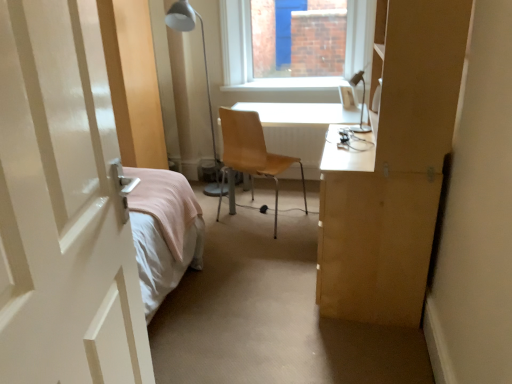
Question: Does light brown wood chair at center have a greater height compared to white glossy door at left?

Choices:
 (A) yes
 (B) no

Answer: (B)

Question: Is light brown wood chair at center wider than white glossy door at left?

Choices:
 (A) yes
 (B) no

Answer: (B)

Question: Could you tell me if light brown wood chair at center is turned towards white glossy door at left?

Choices:
 (A) yes
 (B) no

Answer: (B)

Question: Does light brown wood chair at center appear on the right side of white glossy door at left?

Choices:
 (A) no
 (B) yes

Answer: (B)

Question: Is light brown wood chair at center outside white glossy door at left?

Choices:
 (A) no
 (B) yes

Answer: (B)

Question: Is point (173, 64) positioned closer to the camera than point (245, 114)?

Choices:
 (A) farther
 (B) closer

Answer: (A)

Question: Considering their positions, is white metal table lamp at upper center, the first table lamp in the left-to-right sequence, located in front of or behind light brown wood chair at center?

Choices:
 (A) behind
 (B) front

Answer: (A)

Question: From a real-world perspective, is white metal table lamp at upper center, the first table lamp in the left-to-right sequence, positioned above or below light brown wood chair at center?

Choices:
 (A) above
 (B) below

Answer: (A)

Question: Choose the correct answer: Is white metal table lamp at upper center, which appears as the 2th table lamp when viewed from the front, inside light brown wood chair at center or outside it?

Choices:
 (A) inside
 (B) outside

Answer: (B)

Question: Is light brown wood chair at center spatially inside metallic silver table lamp at upper right, which is the second table lamp in left-to-right order, or outside of it?

Choices:
 (A) outside
 (B) inside

Answer: (A)

Question: Considering the positions of light brown wood chair at center and metallic silver table lamp at upper right, arranged as the 1th table lamp when viewed from the right, in the image, is light brown wood chair at center taller or shorter than metallic silver table lamp at upper right, arranged as the 1th table lamp when viewed from the right,?

Choices:
 (A) short
 (B) tall

Answer: (B)

Question: Looking at the image, does light brown wood chair at center seem bigger or smaller compared to metallic silver table lamp at upper right, arranged as the first table lamp when viewed from the front?

Choices:
 (A) small
 (B) big

Answer: (B)

Question: In the image, is light brown wood chair at center positioned in front of or behind metallic silver table lamp at upper right, the 2th table lamp viewed from the back?

Choices:
 (A) front
 (B) behind

Answer: (B)

Question: Considering the positions of metallic silver table lamp at upper right, which is the second table lamp in left-to-right order, and light brown wood chair at center in the image, is metallic silver table lamp at upper right, which is the second table lamp in left-to-right order, wider or thinner than light brown wood chair at center?

Choices:
 (A) wide
 (B) thin

Answer: (B)

Question: From their relative heights in the image, would you say metallic silver table lamp at upper right, which is the second table lamp in left-to-right order, is taller or shorter than light brown wood chair at center?

Choices:
 (A) short
 (B) tall

Answer: (A)